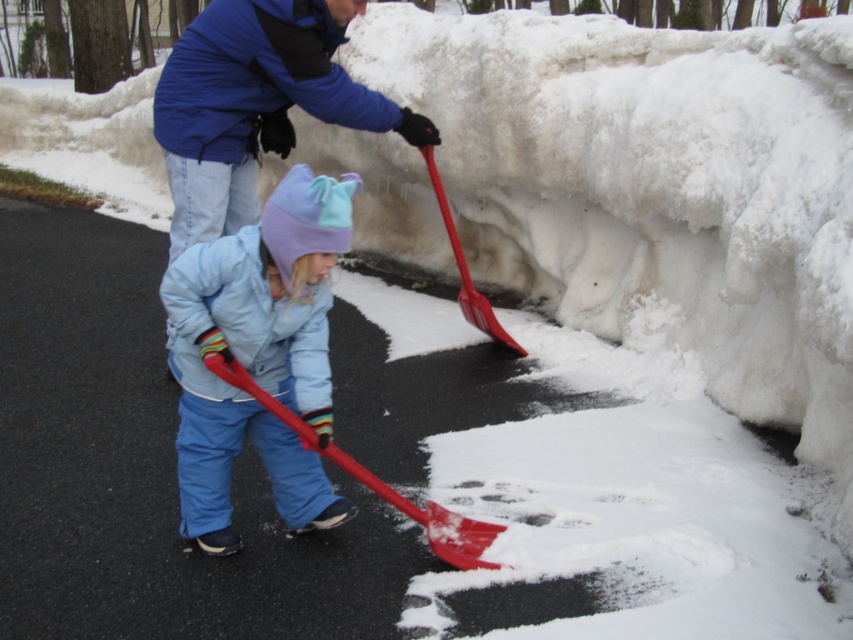
Based on the photo, is blue fleece jacket at upper center positioned in front of red plastic shovel at upper center?

That is True.

Locate an element on the screen. The image size is (853, 640). blue fleece jacket at upper center is located at coordinates click(254, 104).

Which is above, light blue fleece jacket at center or blue fleece jacket at upper center?

Positioned higher is blue fleece jacket at upper center.

In the scene shown: Between light blue fleece jacket at center and blue fleece jacket at upper center, which one has more height?

blue fleece jacket at upper center

The width and height of the screenshot is (853, 640). Describe the element at coordinates (258, 355) in the screenshot. I see `light blue fleece jacket at center` at that location.

The width and height of the screenshot is (853, 640). I want to click on light blue fleece jacket at center, so click(x=258, y=355).

Does red plastic shovel at center appear on the right side of light blue fleece jacket at center?

Yes, red plastic shovel at center is to the right of light blue fleece jacket at center.

Who is more distant from viewer, (83,228) or (199,257)?

Positioned behind is point (83,228).

Locate an element on the screen. red plastic shovel at center is located at coordinates (364, 488).